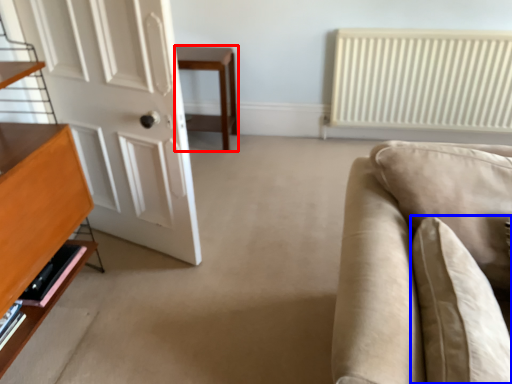
Question: Among these objects, which one is farthest to the camera, table (highlighted by a red box) or pillow (highlighted by a blue box)?

Choices:
 (A) table
 (B) pillow

Answer: (A)